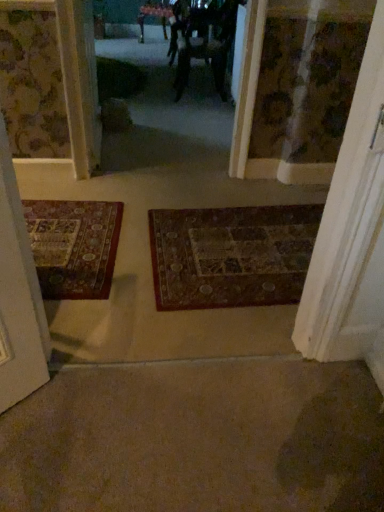
Where is `dark fabric couple at center`? dark fabric couple at center is located at coordinates (203, 41).

In order to face dark fabric couple at center, should I rotate leftwards or rightwards?

To align with it, rotate right about 2.006°.

Find the location of a particular element. Image resolution: width=384 pixels, height=512 pixels. metallic silver mirror at upper center is located at coordinates (154, 16).

The image size is (384, 512). Identify the location of dark brown woven mat at center. (231, 255).

What do you see at coordinates (350, 229) in the screenshot? The width and height of the screenshot is (384, 512). I see `wooden door at right` at bounding box center [350, 229].

The height and width of the screenshot is (512, 384). I want to click on dark fabric couple at center, so click(203, 41).

Consider the image. Is dark brown woven mat at center completely or partially outside of dark fabric couple at center?

dark brown woven mat at center is positioned outside dark fabric couple at center.

From the image's perspective, is dark brown woven mat at center above dark fabric couple at center?

No, from the image's perspective, dark brown woven mat at center is not over dark fabric couple at center.

Considering their positions, is dark brown woven mat at center located in front of or behind dark fabric couple at center?

dark brown woven mat at center is in front of dark fabric couple at center.

Are dark brown woven mat at center and dark fabric couple at center beside each other?

No, dark brown woven mat at center is not with dark fabric couple at center.

Is wooden door at right closer to camera compared to metallic silver mirror at upper center?

That is True.

Which of these two, wooden door at right or metallic silver mirror at upper center, stands shorter?

metallic silver mirror at upper center is shorter.

Where is `furniture above the wooden door at right (from the image's perspective)`? The width and height of the screenshot is (384, 512). furniture above the wooden door at right (from the image's perspective) is located at coordinates (154, 16).

Does wooden door at right appear on the right side of metallic silver mirror at upper center?

Yes, wooden door at right is to the right of metallic silver mirror at upper center.

Is dark brown woven mat at center surrounded by metallic silver mirror at upper center?

No, dark brown woven mat at center is not surrounded by metallic silver mirror at upper center.

How many degrees apart are the facing directions of metallic silver mirror at upper center and dark brown woven mat at center?

metallic silver mirror at upper center and dark brown woven mat at center are facing 55.6 degrees away from each other.

Can you confirm if metallic silver mirror at upper center is thinner than dark brown woven mat at center?

Indeed, metallic silver mirror at upper center has a lesser width compared to dark brown woven mat at center.

Are metallic silver mirror at upper center and dark brown woven mat at center beside each other?

There is a gap between metallic silver mirror at upper center and dark brown woven mat at center.

Based on their sizes in the image, would you say dark brown woven mat at center is bigger or smaller than wooden door at right?

dark brown woven mat at center is smaller than wooden door at right.

From a real-world perspective, which object stands above the other?

In real-world perspective, wooden door at right is above.

Would you say dark brown woven mat at center is outside wooden door at right?

dark brown woven mat at center is positioned outside wooden door at right.

Between wooden door at right and dark brown woven mat at center, which one has smaller size?

dark brown woven mat at center.

Does wooden door at right come behind dark brown woven mat at center?

No, wooden door at right is in front of dark brown woven mat at center.

Is wooden door at right turned away from dark brown woven mat at center?

That's not correct — wooden door at right is not looking away from dark brown woven mat at center.

From the image's perspective, between wooden door at right and dark brown woven mat at center, which one is located above?

wooden door at right, from the image's perspective.

At what (x,y) coordinates should I click in order to perform the action: click on couple lying behind the dark brown woven mat at center. Please return your answer as a coordinate pair (x, y). The image size is (384, 512). Looking at the image, I should click on [203, 41].

Are dark fabric couple at center and dark brown woven mat at center beside each other?

No, dark fabric couple at center is not making contact with dark brown woven mat at center.

Would you say dark fabric couple at center is inside or outside dark brown woven mat at center?

dark fabric couple at center is located beyond the bounds of dark brown woven mat at center.

Can you tell me how much dark fabric couple at center and dark brown woven mat at center differ in facing direction?

The angular difference between dark fabric couple at center and dark brown woven mat at center is 1.23 degrees.

Is metallic silver mirror at upper center wider than wooden door at right?

Indeed, metallic silver mirror at upper center has a greater width compared to wooden door at right.

Is metallic silver mirror at upper center positioned before wooden door at right?

No, the depth of metallic silver mirror at upper center is greater than that of wooden door at right.

How different are the orientations of metallic silver mirror at upper center and wooden door at right in degrees?

The angular difference between metallic silver mirror at upper center and wooden door at right is 55.6 degrees.

Is metallic silver mirror at upper center bigger or smaller than wooden door at right?

In the image, metallic silver mirror at upper center appears to be larger than wooden door at right.

In order to click on mat located underneath the dark fabric couple at center (from a real-world perspective) in this screenshot , I will do `click(231, 255)`.

Locate an element on the screen. The width and height of the screenshot is (384, 512). furniture on the left of wooden door at right is located at coordinates (154, 16).

Looking at the image, which one is located further to wooden door at right, dark brown woven mat at center or dark fabric couple at center?

dark fabric couple at center is positioned further to the anchor wooden door at right.

Consider the image. Which object lies further to the anchor point dark brown woven mat at center, metallic silver mirror at upper center or wooden door at right?

metallic silver mirror at upper center is further to dark brown woven mat at center.

From the image, which object appears to be farther from dark fabric couple at center, metallic silver mirror at upper center or dark brown woven mat at center?

Based on the image, dark brown woven mat at center appears to be further to dark fabric couple at center.

When comparing their distances from dark brown woven mat at center, does wooden door at right or metallic silver mirror at upper center seem closer?

wooden door at right is closer to dark brown woven mat at center.

Which object lies nearer to the anchor point wooden door at right, dark fabric couple at center or dark brown woven mat at center?

Among the two, dark brown woven mat at center is located nearer to wooden door at right.

In the scene shown: Estimate the real-world distances between objects in this image. Which object is further from wooden door at right, metallic silver mirror at upper center or dark brown woven mat at center?

metallic silver mirror at upper center is further to wooden door at right.

Based on their spatial positions, is dark fabric couple at center or metallic silver mirror at upper center further from wooden door at right?

Based on the image, metallic silver mirror at upper center appears to be further to wooden door at right.

Which object lies nearer to the anchor point dark brown woven mat at center, wooden door at right or dark fabric couple at center?

wooden door at right is closer to dark brown woven mat at center.

Identify the location of mat between wooden door at right and dark fabric couple at center from front to back. (231, 255).

This screenshot has width=384, height=512. Identify the location of couple located between wooden door at right and metallic silver mirror at upper center in the depth direction. (203, 41).

The image size is (384, 512). What are the coordinates of `couple between dark brown woven mat at center and metallic silver mirror at upper center in the front-back direction` in the screenshot? It's located at (203, 41).

I want to click on mat between wooden door at right and metallic silver mirror at upper center from front to back, so click(x=231, y=255).